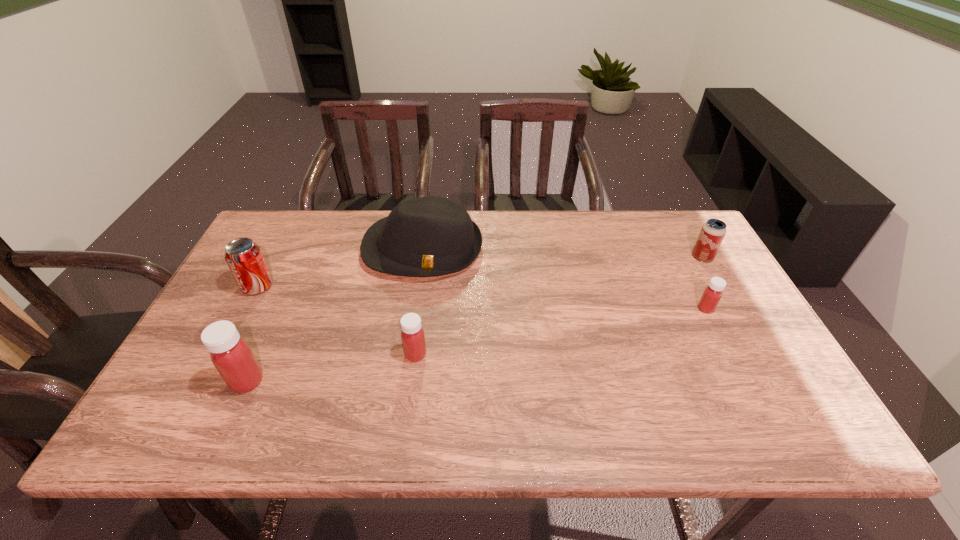
Identify which object is the third closest to the rightmost object. Please provide its 2D coordinates. Your answer should be formatted as a tuple, i.e. [(x, y)], where the tuple contains the x and y coordinates of a point satisfying the conditions above.

[(413, 339)]

Locate which object ranks third in proximity to the rightmost object. Please provide its 2D coordinates. Your answer should be formatted as a tuple, i.e. [(x, y)], where the tuple contains the x and y coordinates of a point satisfying the conditions above.

[(413, 339)]

Locate which medicine is the second closest to the fifth farthest object. Please provide its 2D coordinates. Your answer should be formatted as a tuple, i.e. [(x, y)], where the tuple contains the x and y coordinates of a point satisfying the conditions above.

[(712, 294)]

Point out which medicine is positioned as the second nearest to the farthest medicine. Please provide its 2D coordinates. Your answer should be formatted as a tuple, i.e. [(x, y)], where the tuple contains the x and y coordinates of a point satisfying the conditions above.

[(231, 355)]

Locate an element on the screen. The height and width of the screenshot is (540, 960). vacant area in the image that satisfies the following two spatial constraints: 1. on the back side of the second farthest medicine; 2. on the left side of the rightmost medicine is located at coordinates (421, 308).

This screenshot has height=540, width=960. Find the location of `free location that satisfies the following two spatial constraints: 1. on the front-facing side of the fedora; 2. on the right side of the second shortest medicine`. free location that satisfies the following two spatial constraints: 1. on the front-facing side of the fedora; 2. on the right side of the second shortest medicine is located at coordinates [x=407, y=354].